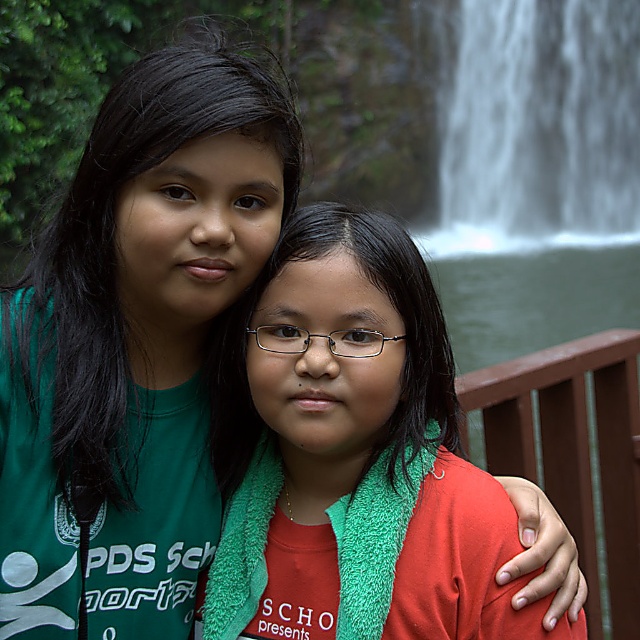
You are a photographer trying to capture a shot of the white misty waterfall at upper right. You notice a point marked at coordinates [540,129]. Based on the scene description, where is this point located in relation to the waterfall?

The point at coordinates [540,129] corresponds to the white misty waterfall at upper right, so it is located exactly at the waterfall.

You are a photographer trying to capture a closeup of the red fleece scarf at center and the brown wooden rail at upper right in the scene. Which object should you zoom in on first to ensure it fits entirely in the frame?

You should zoom in on the red fleece scarf at center first because it is shorter than the brown wooden rail at upper right, so it requires less zoom to fit in the frame.

You are a photographer trying to capture a clear shot of the red fleece scarf at center and the white misty waterfall at upper right. Which object should you focus on first to ensure both are in focus?

You should focus on the red fleece scarf at center first because it is closer to the viewer than the white misty waterfall at upper right. By focusing on the closer object, the waterfall will likely be in focus as well due to the depth of field.